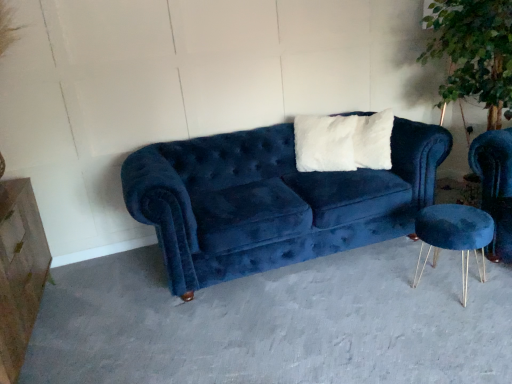
Question: Considering their positions, is velvet blue couch at center located in front of or behind white fluffy pillow at center?

Choices:
 (A) front
 (B) behind

Answer: (A)

Question: Is velvet blue couch at center bigger or smaller than white fluffy pillow at center?

Choices:
 (A) small
 (B) big

Answer: (B)

Question: Which object is the closest to the green leafy plant at upper right?

Choices:
 (A) velvet blue couch at center
 (B) velvet blue stool at lower right
 (C) velvet blue couch at center
 (D) marble/stone dresser at left
 (E) white fluffy pillow at center

Answer: (E)

Question: Estimate the real-world distances between objects in this image. Which object is farther from the marble/stone dresser at left?

Choices:
 (A) white fluffy pillow at center
 (B) velvet blue couch at center
 (C) velvet blue stool at lower right
 (D) green leafy plant at upper right
 (E) velvet blue couch at center

Answer: (D)